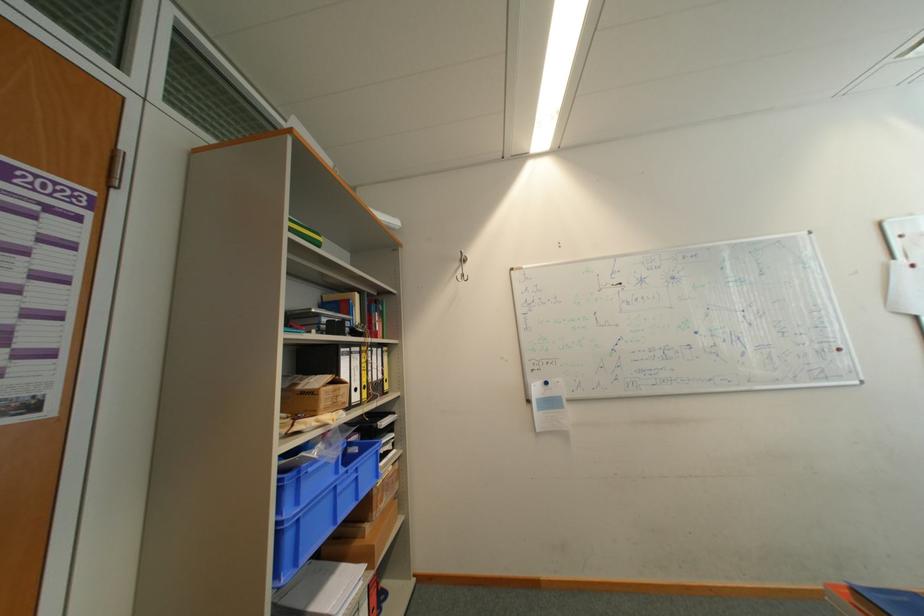
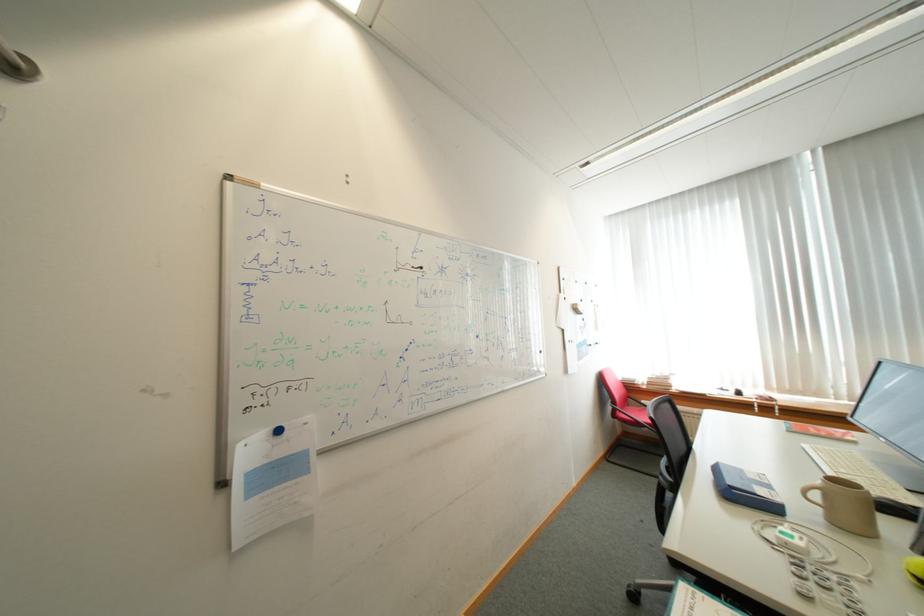
Question: The camera is either moving clockwise (left) or counter-clockwise (right) around the object. The first image is from the beginning of the video and the second image is from the end. Is the camera moving left or right when shooting the video?

Choices:
 (A) Left
 (B) Right

Answer: (A)